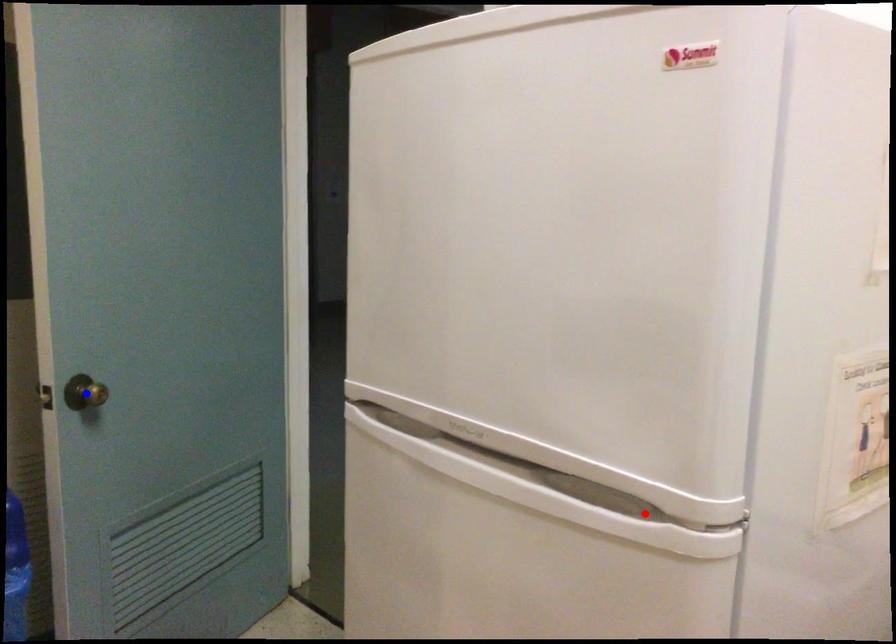
Question: Which of the two points in the image is closer to the camera?

Choices:
 (A) Blue point is closer.
 (B) Red point is closer.

Answer: (B)